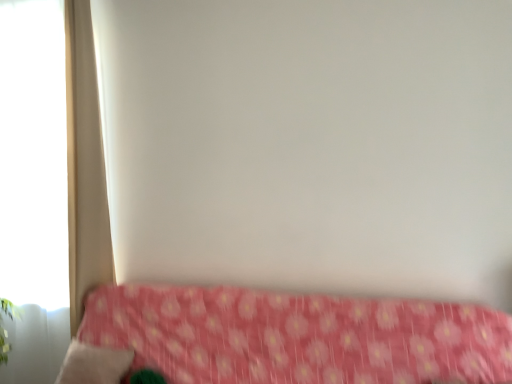
Question: Is white matte window at left bigger than pink floral fabric at lower center?

Choices:
 (A) no
 (B) yes

Answer: (A)

Question: Is white matte window at left at the right side of pink floral fabric at lower center?

Choices:
 (A) no
 (B) yes

Answer: (A)

Question: Is white matte window at left beside pink floral fabric at lower center?

Choices:
 (A) no
 (B) yes

Answer: (A)

Question: Considering the relative sizes of white matte window at left and pink floral fabric at lower center in the image provided, is white matte window at left smaller than pink floral fabric at lower center?

Choices:
 (A) yes
 (B) no

Answer: (A)

Question: From a real-world perspective, is white matte window at left located higher than pink floral fabric at lower center?

Choices:
 (A) no
 (B) yes

Answer: (B)

Question: Could you tell me if white matte window at left is facing pink floral fabric at lower center?

Choices:
 (A) yes
 (B) no

Answer: (B)

Question: Is beige fabric pillow at lower left oriented towards white fabric curtain at left?

Choices:
 (A) yes
 (B) no

Answer: (B)

Question: Is the depth of beige fabric pillow at lower left less than that of white fabric curtain at left?

Choices:
 (A) no
 (B) yes

Answer: (B)

Question: Is beige fabric pillow at lower left to the right of white fabric curtain at left from the viewer's perspective?

Choices:
 (A) yes
 (B) no

Answer: (A)

Question: Is beige fabric pillow at lower left turned away from white fabric curtain at left?

Choices:
 (A) no
 (B) yes

Answer: (A)

Question: Would you say beige fabric pillow at lower left is a long distance from white fabric curtain at left?

Choices:
 (A) yes
 (B) no

Answer: (B)

Question: Can you confirm if beige fabric pillow at lower left is shorter than white fabric curtain at left?

Choices:
 (A) no
 (B) yes

Answer: (B)

Question: Can you see white fabric curtain at left touching beige fabric pillow at lower left?

Choices:
 (A) yes
 (B) no

Answer: (B)